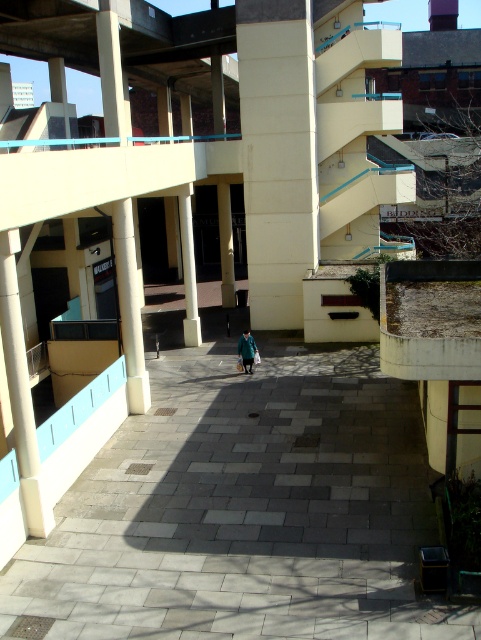
Does point (223, 280) lie in front of point (249, 340)?

No, it is behind (249, 340).

Can you confirm if matte yellow pillar at center is bigger than green fabric coat at center?

Actually, matte yellow pillar at center might be smaller than green fabric coat at center.

Which is behind, point (228, 221) or point (249, 371)?

Positioned behind is point (228, 221).

Identify the location of matte yellow pillar at center. (226, 244).

Is the position of white concrete pillar at center less distant than that of green fabric coat at center?

No, it is not.

Does white concrete pillar at center have a greater width compared to green fabric coat at center?

Yes, white concrete pillar at center is wider than green fabric coat at center.

Between point (185, 317) and point (247, 364), which one is positioned behind?

The point (185, 317) is more distant.

The width and height of the screenshot is (481, 640). In order to click on white concrete pillar at center in this screenshot , I will do `click(189, 268)`.

Does point (433, 627) come farther from viewer compared to point (278, 244)?

No, it is in front of (278, 244).

Which is below, gray concrete pavement at center or beige concrete pillar at center?

gray concrete pavement at center

Is point (370, 513) more distant than point (277, 253)?

No, it is not.

I want to click on gray concrete pavement at center, so click(245, 509).